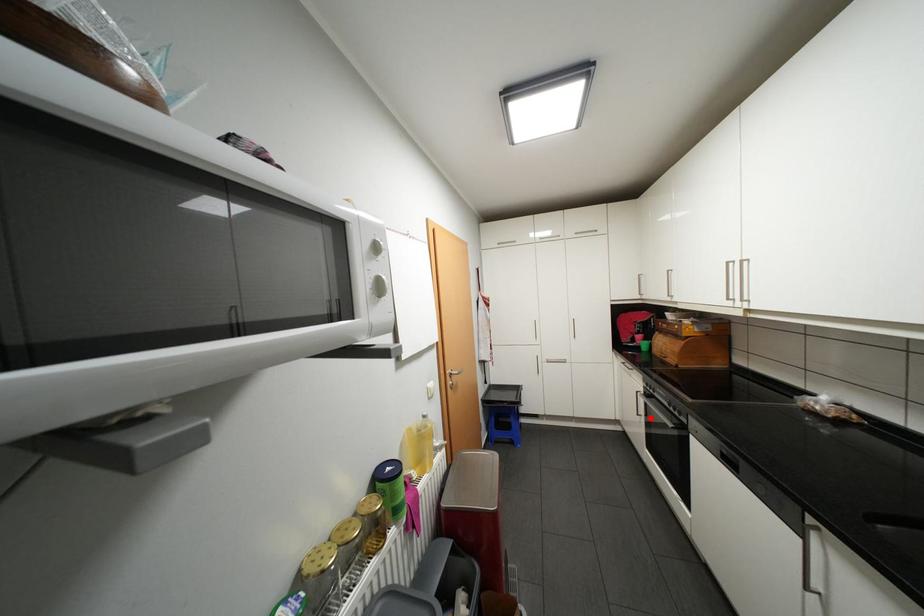
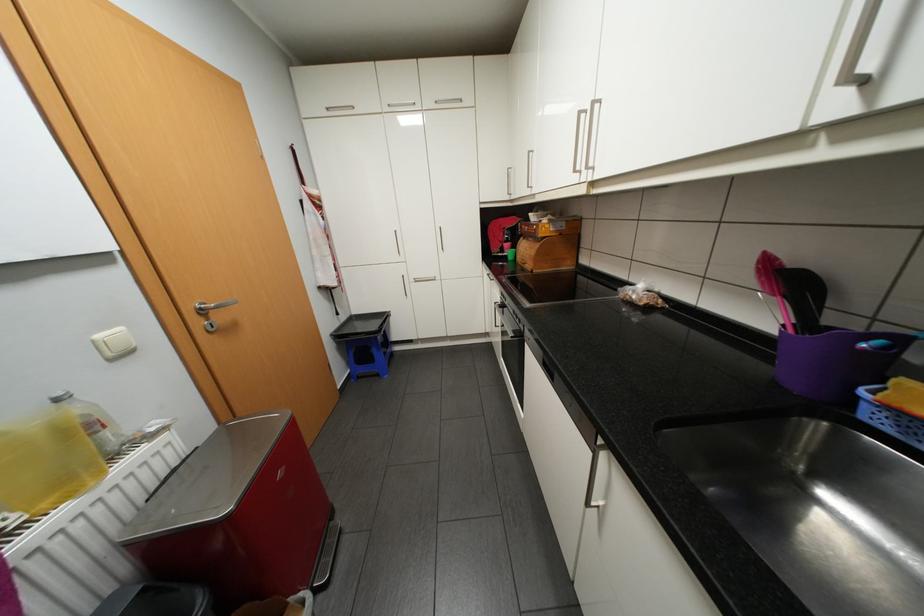
Question: I am providing you with two images of the same scene from different viewpoints. Given a red point in image1, look at the same physical point in image2. Is it:

Choices:
 (A) Closer to the viewpoint
 (B) Farther from the viewpoint

Answer: (B)